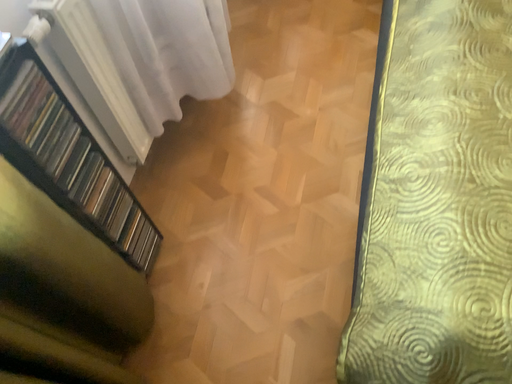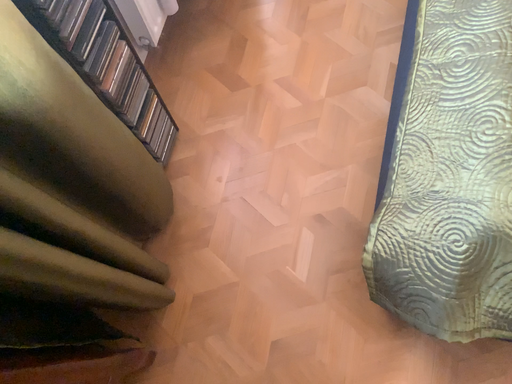
Question: Which way did the camera rotate in the video?

Choices:
 (A) rotated downward
 (B) rotated upward

Answer: (A)